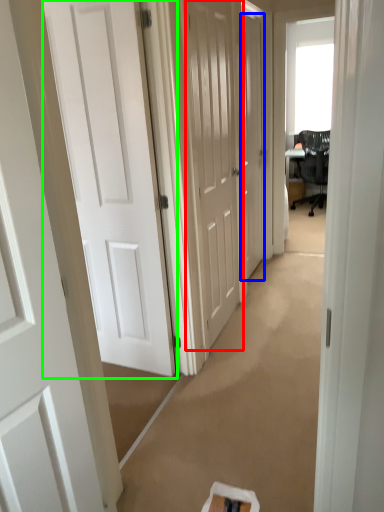
Question: Estimate the real-world distances between objects in this image. Which object is closer to door (highlighted by a red box), door (highlighted by a blue box) or door (highlighted by a green box)?

Choices:
 (A) door
 (B) door

Answer: (B)